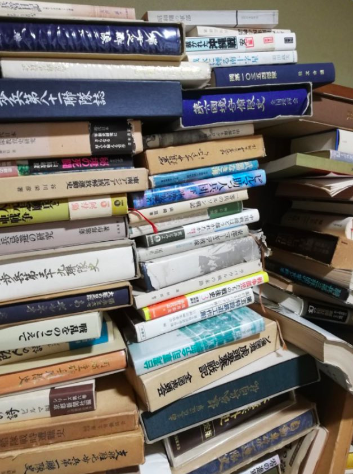
Identify the location of 7 dark blue books. (110, 39), (108, 296), (271, 368), (252, 105), (282, 75), (75, 97), (293, 427).